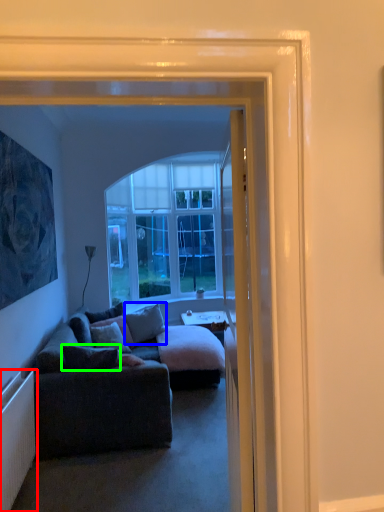
Question: Which object is positioned closest to radiator (highlighted by a red box)? Select from pillow (highlighted by a blue box) and pillow (highlighted by a green box).

Choices:
 (A) pillow
 (B) pillow

Answer: (B)